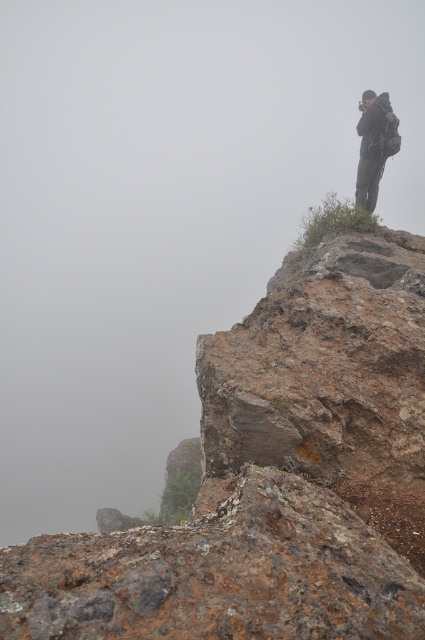
You are a hiker who has just reached the cliff edge. You notice the rusty rock at center and the dark gray backpack at upper right. Which object is smaller in size?

The rusty rock at center is smaller in size compared to the dark gray backpack at upper right.

You are a hiker trying to navigate through the rugged landscape. You see the rusty rock cliff at upper right and the rusty rock at center. Which object takes up more space in the image?

The rusty rock at center occupies more space than the rusty rock cliff at upper right.